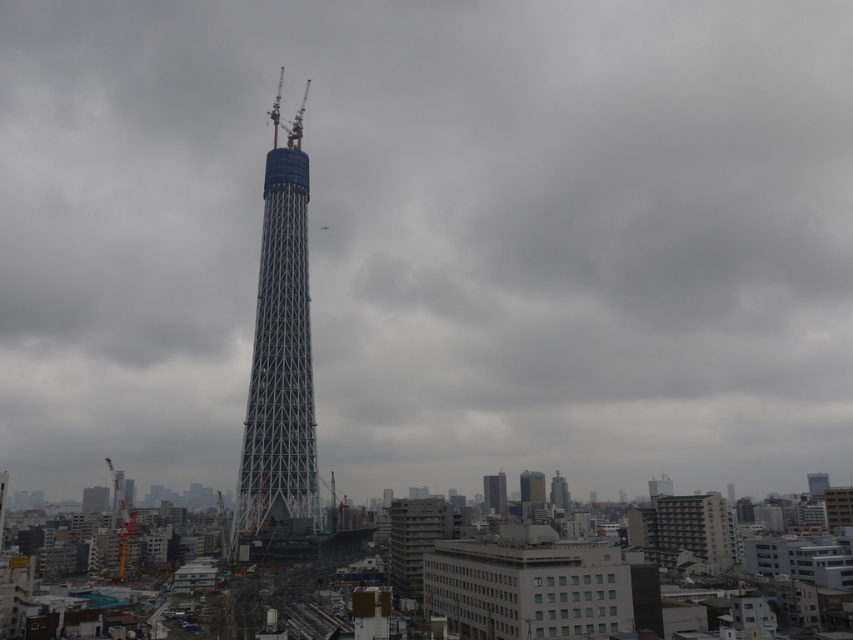
Question: Is silver metallic tower at center wider than smooth gray skyscraper at center?

Choices:
 (A) yes
 (B) no

Answer: (A)

Question: Observing the image, what is the correct spatial positioning of silver metallic tower at center in reference to smooth gray skyscraper at center?

Choices:
 (A) below
 (B) above

Answer: (B)

Question: Based on their relative distances, which object is farther from the smooth gray skyscraper at center?

Choices:
 (A) metallic silver tower at center
 (B) silver metallic tower at center

Answer: (B)

Question: Based on their relative distances, which object is nearer to the silver metallic tower at center?

Choices:
 (A) smooth gray skyscraper at center
 (B) metallic silver tower at center

Answer: (B)

Question: Which object appears farthest from the camera in this image?

Choices:
 (A) silver metallic tower at center
 (B) metallic silver tower at center
 (C) smooth gray skyscraper at center

Answer: (B)

Question: Does metallic silver tower at center appear under smooth gray skyscraper at center?

Choices:
 (A) yes
 (B) no

Answer: (B)